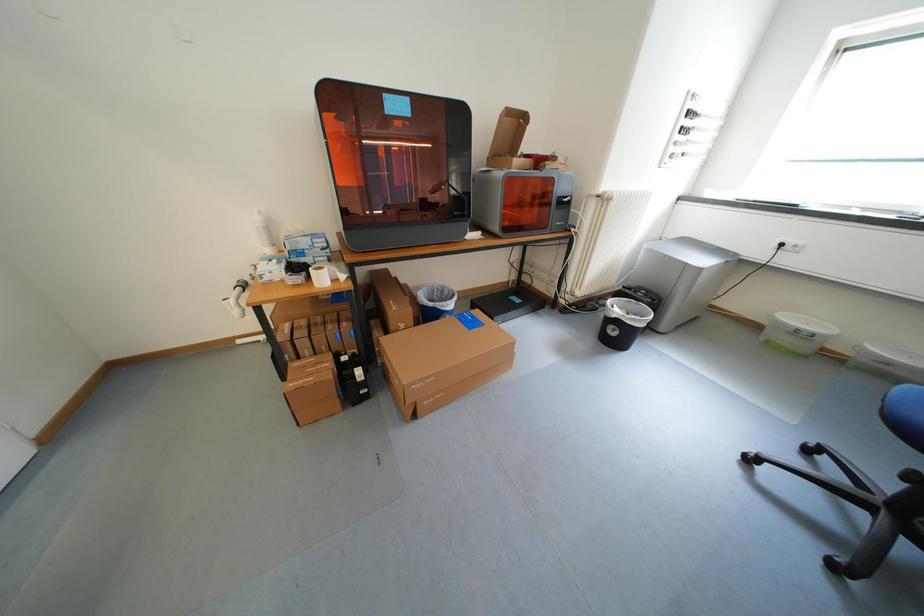
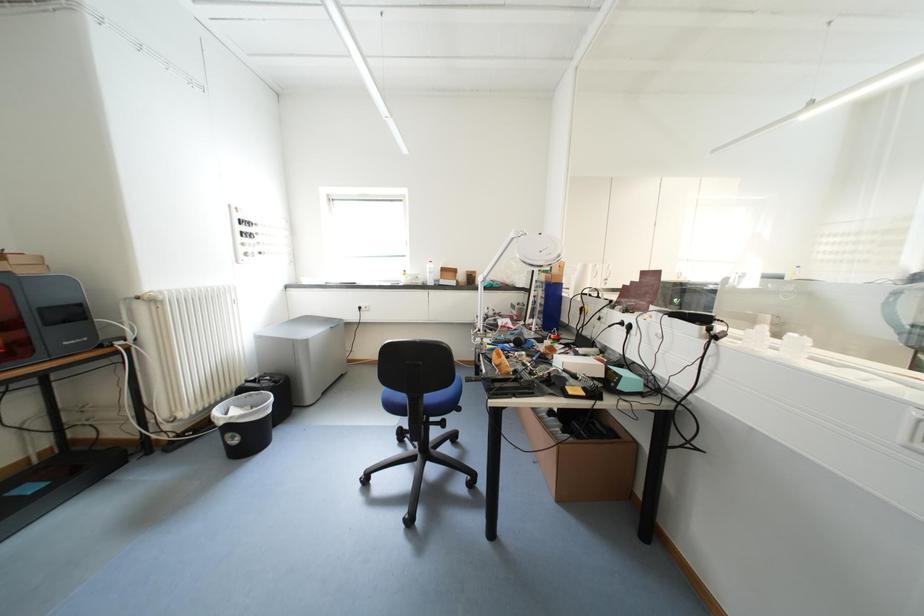
Question: The camera is either moving clockwise (left) or counter-clockwise (right) around the object. The first image is from the beginning of the video and the second image is from the end. Is the camera moving left or right when shooting the video?

Choices:
 (A) Left
 (B) Right

Answer: (A)